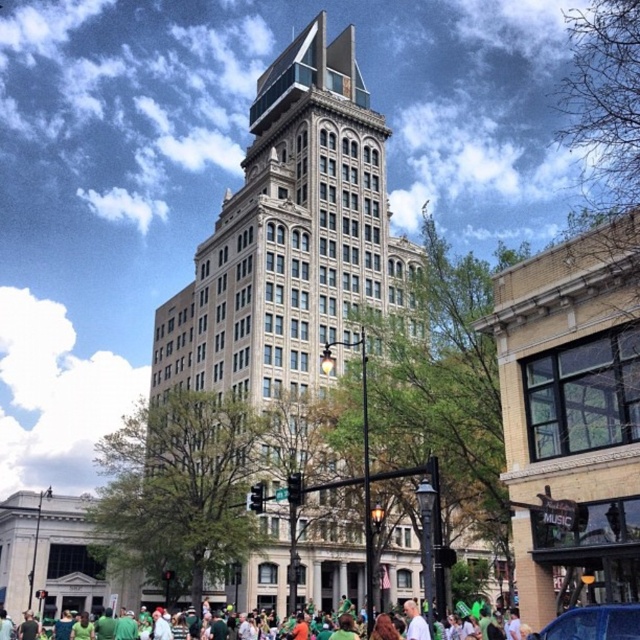
You are a photographer trying to capture the beige stone building at center and the green fabric crowd at lower center in a single frame. Based on their sizes in the image, which one will appear larger in your photo?

The beige stone building at center appears larger in the photo because it has a greater height compared to the green fabric crowd at lower center.

You are a delivery person who needs to park your shiny blue car at lower right as close as possible to the beige stone building at center without blocking the sidewalk. According to the city regulations, vehicles must be parked at least 5 meters away from any building. Can you park your car closer than the current distance?

The beige stone building at center and shiny blue car at lower right are 43.70 meters apart. Since the minimum required distance is 5 meters, you can park the shiny blue car at lower right closer to the beige stone building at center as long as it stays at least 5 meters away.

You are a photographer standing in the street and want to capture both the beige stone building at center and the green fabric crowd at lower center in a single shot. Based on their positions, which object should be placed closer to the camera to ensure both are visible without cropping?

The beige stone building at center should be placed closer to the camera since the green fabric crowd at lower center is behind it, allowing both to be visible in the frame without cropping.